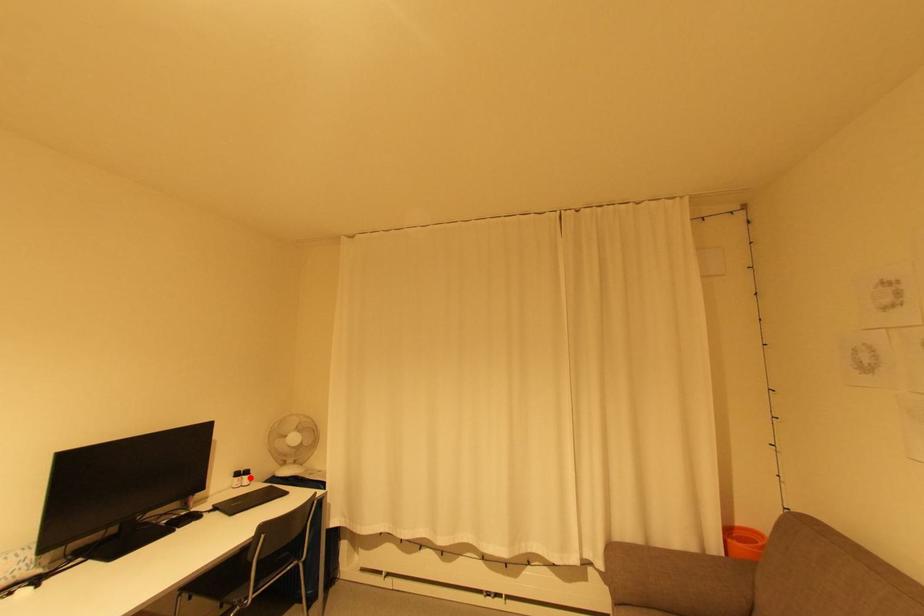
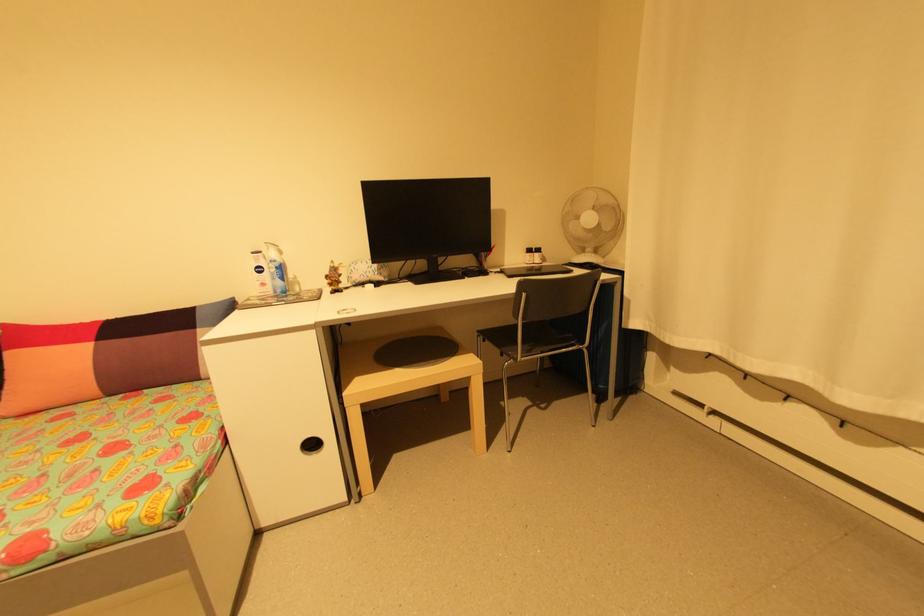
The point at the highlighted location is marked in the first image. Where is the corresponding point in the second image?

(541, 254)